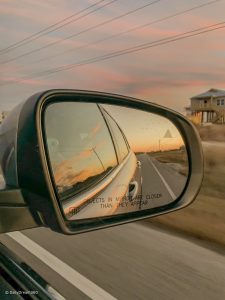
Image resolution: width=225 pixels, height=300 pixels. What are the coordinates of `mirror coverr` in the screenshot? It's located at (34, 143).